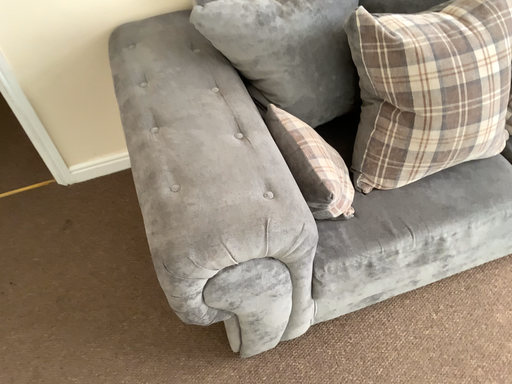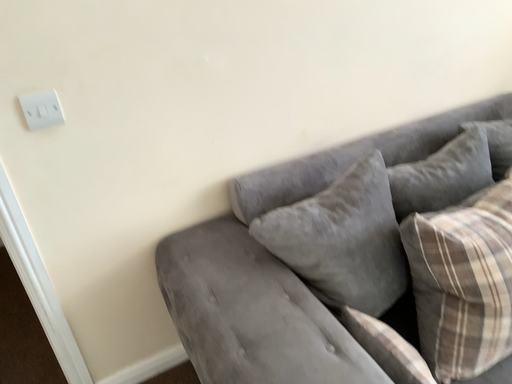
Question: Which way did the camera rotate in the video?

Choices:
 (A) rotated upward
 (B) rotated downward

Answer: (A)